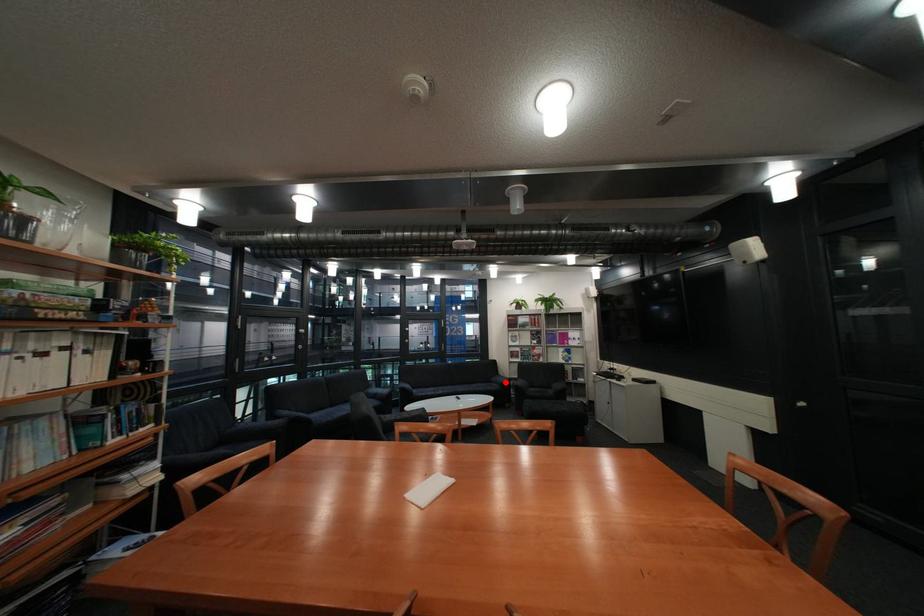
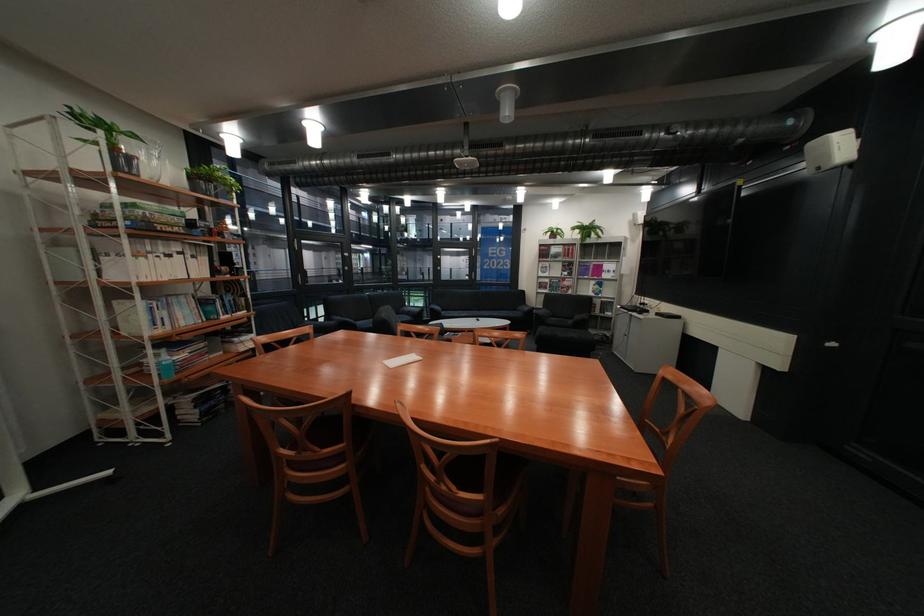
The point at the highlighted location is marked in the first image. Where is the corresponding point in the second image?

(531, 310)